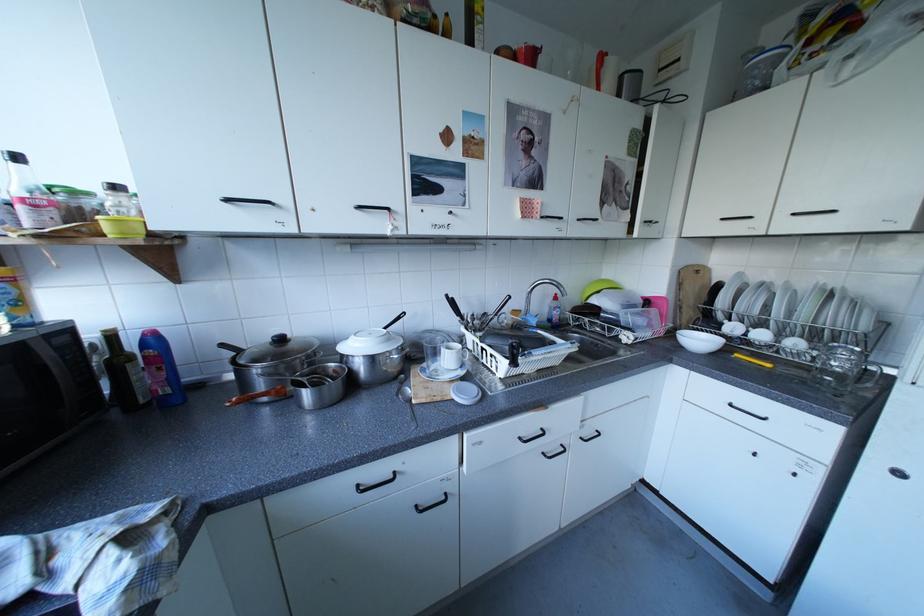
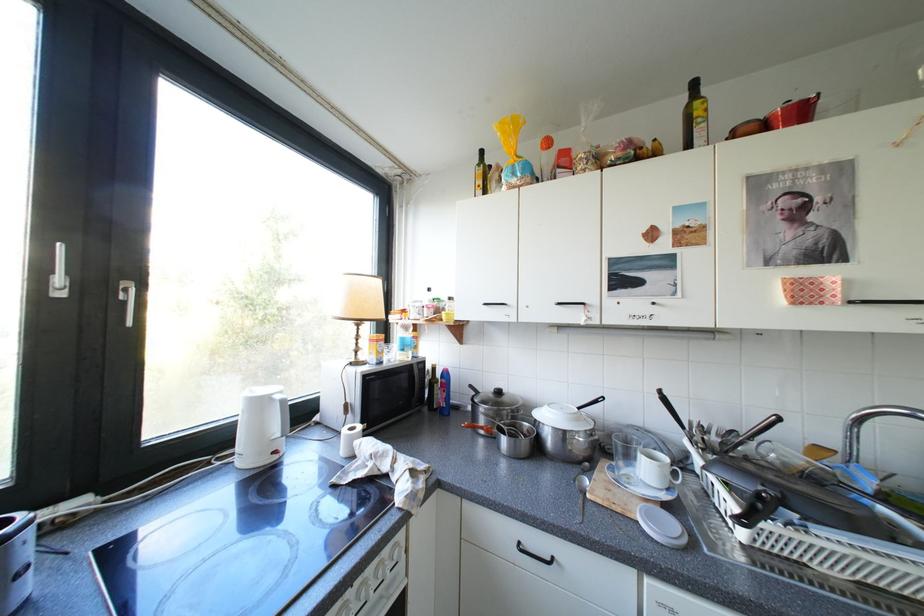
Question: The camera is either moving clockwise (left) or counter-clockwise (right) around the object. The first image is from the beginning of the video and the second image is from the end. Is the camera moving left or right when shooting the video?

Choices:
 (A) Left
 (B) Right

Answer: (B)